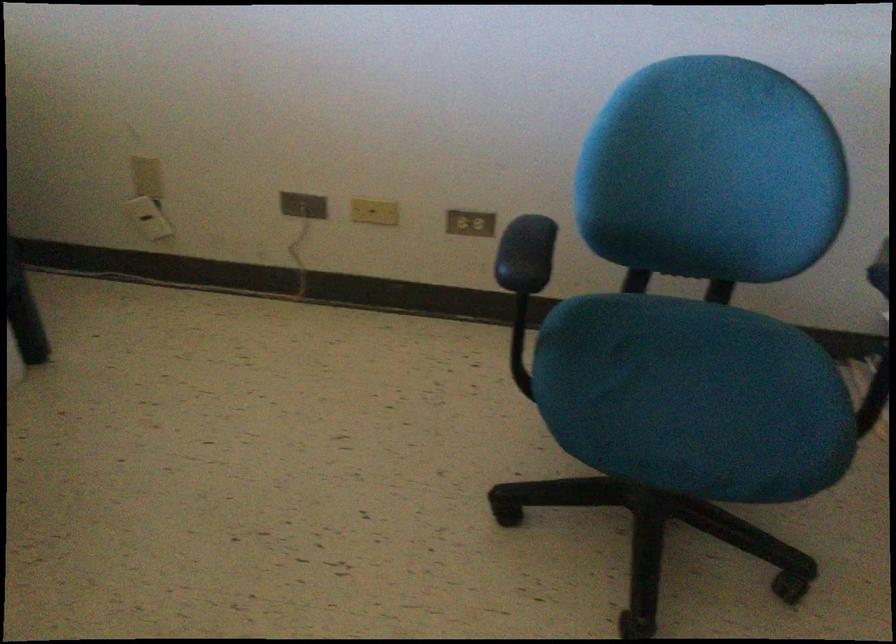
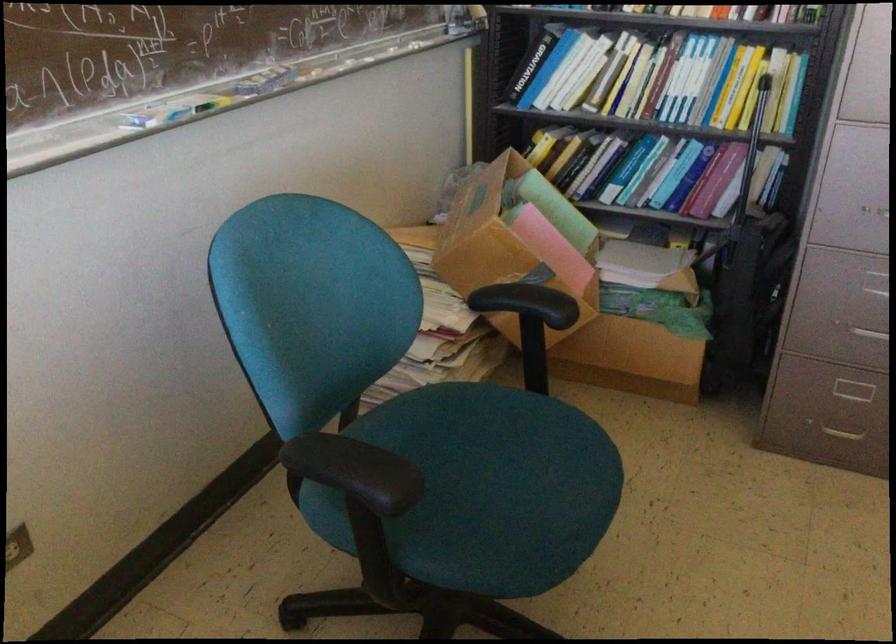
Question: Based on the continuous images, in which direction is the camera rotating? Reply with the corresponding letter.

Choices:
 (A) Left
 (B) Right
 (C) Up
 (D) Down

Answer: (B)